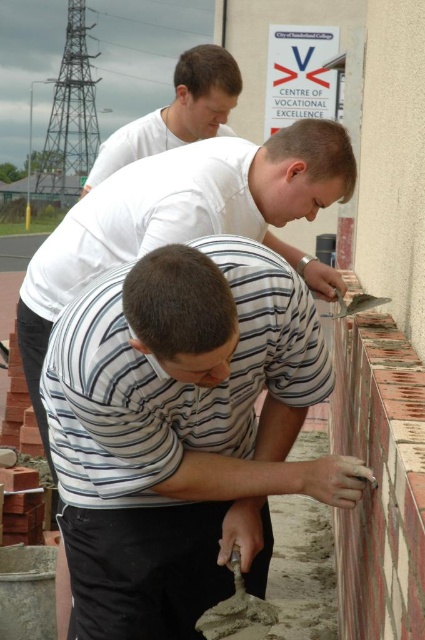
Is white matte shirt at center thinner than rustic clay bricks at right?

No, white matte shirt at center is not thinner than rustic clay bricks at right.

Is white matte shirt at center shorter than rustic clay bricks at right?

No, white matte shirt at center is not shorter than rustic clay bricks at right.

The height and width of the screenshot is (640, 425). In order to click on white matte shirt at center in this screenshot , I will do `click(186, 218)`.

Which is behind, point (170, 602) or point (399, 544)?

Point (170, 602)

Locate an element on the screen. This screenshot has width=425, height=640. white striped shirt at center is located at coordinates 181,429.

Locate an element on the screen. Image resolution: width=425 pixels, height=640 pixels. white striped shirt at center is located at coordinates (181, 429).

Locate an element on the screen. rustic clay bricks at right is located at coordinates (379, 480).

Describe the element at coordinates (379, 480) in the screenshot. This screenshot has height=640, width=425. I see `rustic clay bricks at right` at that location.

This screenshot has width=425, height=640. I want to click on rustic clay bricks at right, so tap(379, 480).